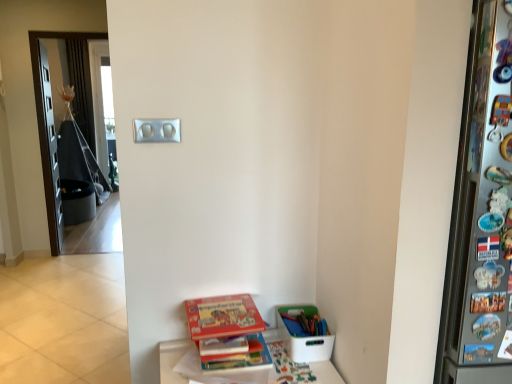
Question: From the image's perspective, is silver metallic light switch at upper center above or below white plastic container at lower right?

Choices:
 (A) below
 (B) above

Answer: (B)

Question: Considering the positions of silver metallic light switch at upper center and white plastic container at lower right in the image, is silver metallic light switch at upper center wider or thinner than white plastic container at lower right?

Choices:
 (A) wide
 (B) thin

Answer: (B)

Question: Based on their relative distances, which object is nearer to the white plastic container at lower right?

Choices:
 (A) stacked books at lower right
 (B) hardcover book at lower center, the 1th book positioned from the bottom
 (C) silver metallic light switch at upper center
 (D) hardcover book at lower center, which ranks as the 1th book in top-to-bottom order

Answer: (B)

Question: Considering the real-world distances, which object is farthest from the hardcover book at lower center, the 1th book positioned from the bottom?

Choices:
 (A) silver metallic light switch at upper center
 (B) white plastic container at lower right
 (C) stacked books at lower right
 (D) hardcover book at lower center, which ranks as the 1th book in top-to-bottom order

Answer: (A)